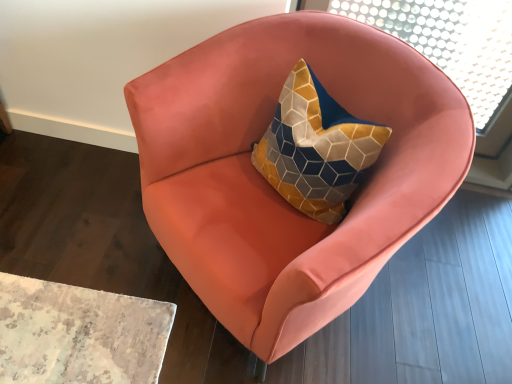
The image size is (512, 384). I want to click on free space to the right of satin coral armchair at center, so click(440, 302).